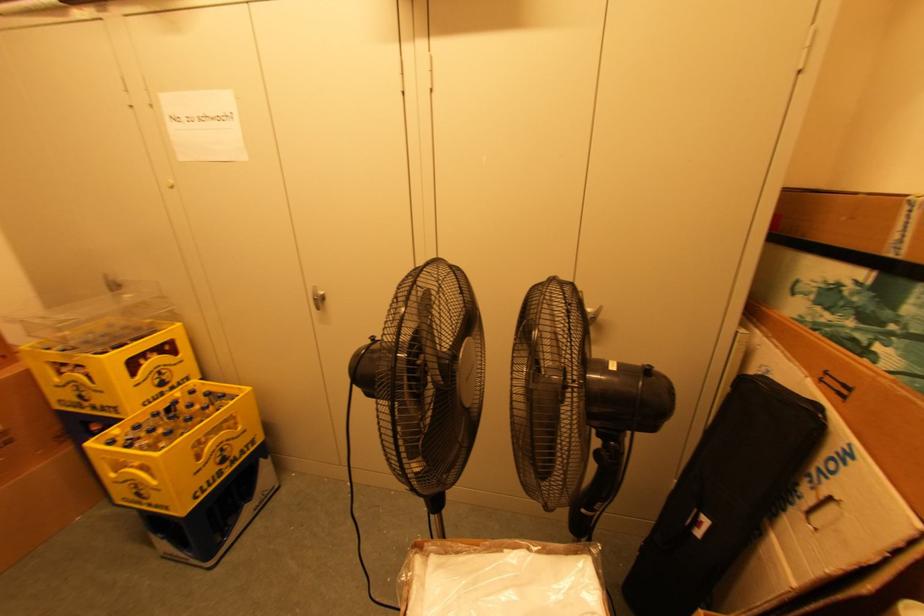
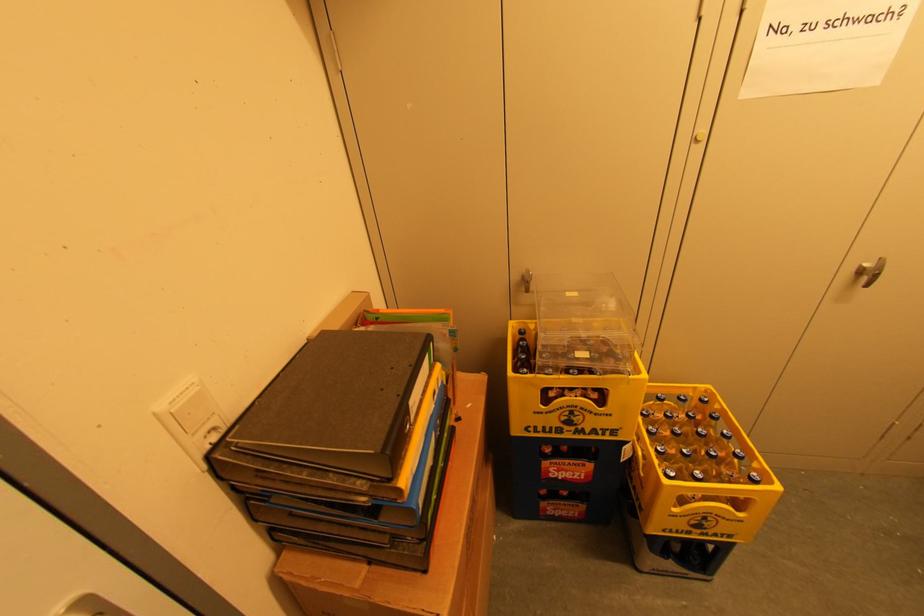
In the second image, find the point that corresponds to point (87, 394) in the first image.

(578, 419)